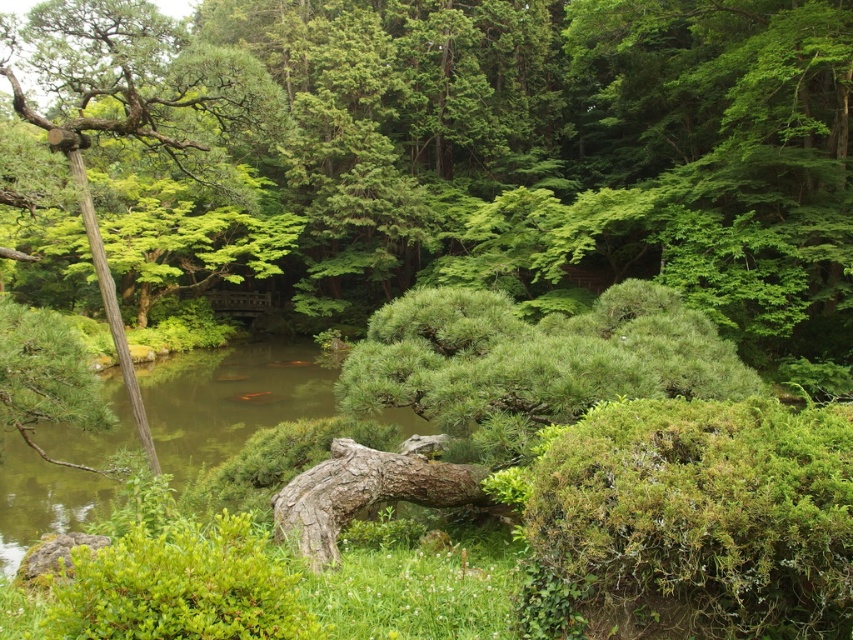
You are a gardener who needs to place a 25 feet long decorative fence between the green mossy bush at lower right and the green leafy tree at left. Based on the scene, will the fence fit between them?

The distance between the green mossy bush at lower right and the green leafy tree at left is 24.96 feet. Since the fence is 25 feet long, it will not fit between them as the space is slightly shorter than the fence.

You are a gardener planning to trim the green mossy bush at lower right and the green leafy tree at left. Based on their sizes, which one would require more time and effort to trim?

The green leafy tree at left would require more time and effort to trim because it is larger than the green mossy bush at lower right.

You are a gardener planning to place a decorative stone between the green mossy bush at lower right and the green leafy tree at left. Based on their widths, which object should the stone be closer to?

The green mossy bush at lower right has a lesser width compared to the green leafy tree at left, so the decorative stone should be placed closer to the green mossy bush at lower right to account for its smaller size.